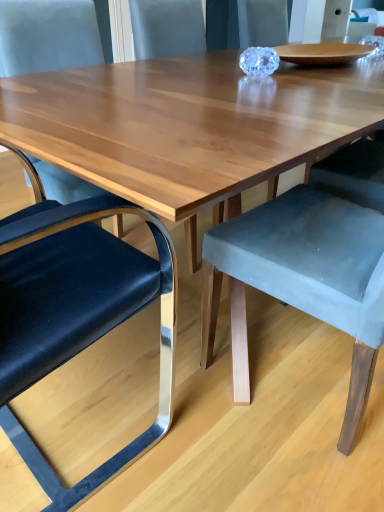
Question: Is metallic blue cushioned chair at left, the 1th chair from the left, positioned before velvet grey chair at center, which is counted as the third chair, starting from the left?

Choices:
 (A) no
 (B) yes

Answer: (B)

Question: Can you confirm if metallic blue cushioned chair at left, which ranks as the third chair in right-to-left order, is taller than velvet grey chair at center, which appears as the 1th chair when viewed from the right?

Choices:
 (A) no
 (B) yes

Answer: (A)

Question: Is the depth of metallic blue cushioned chair at left, the 1th chair from the left, greater than that of velvet grey chair at center, which is counted as the third chair, starting from the left?

Choices:
 (A) yes
 (B) no

Answer: (B)

Question: Can you confirm if metallic blue cushioned chair at left, the 1th chair from the left, is thinner than velvet grey chair at center, which is counted as the third chair, starting from the left?

Choices:
 (A) yes
 (B) no

Answer: (A)

Question: Are metallic blue cushioned chair at left, which ranks as the third chair in right-to-left order, and velvet grey chair at center, which appears as the 1th chair when viewed from the right, far apart?

Choices:
 (A) yes
 (B) no

Answer: (B)

Question: Considering the positions of metallic blue cushioned chair at left, the 1th chair from the left, and velvet blue chair at left, acting as the 2th chair starting from the right, in the image, is metallic blue cushioned chair at left, the 1th chair from the left, wider or thinner than velvet blue chair at left, acting as the 2th chair starting from the right,?

Choices:
 (A) thin
 (B) wide

Answer: (A)

Question: In the image, is metallic blue cushioned chair at left, the 1th chair from the left, positioned in front of or behind velvet blue chair at left, which is counted as the second chair, starting from the left?

Choices:
 (A) front
 (B) behind

Answer: (A)

Question: Does point (8, 429) appear closer or farther from the camera than point (71, 189)?

Choices:
 (A) closer
 (B) farther

Answer: (A)

Question: From a real-world perspective, is metallic blue cushioned chair at left, the 1th chair from the left, positioned above or below velvet blue chair at left, acting as the 2th chair starting from the right?

Choices:
 (A) above
 (B) below

Answer: (B)

Question: From a real-world perspective, is velvet blue chair at left, acting as the 2th chair starting from the right, above or below velvet grey chair at center, which is counted as the third chair, starting from the left?

Choices:
 (A) below
 (B) above

Answer: (B)

Question: Considering the relative positions of velvet blue chair at left, acting as the 2th chair starting from the right, and velvet grey chair at center, which is counted as the third chair, starting from the left, in the image provided, is velvet blue chair at left, acting as the 2th chair starting from the right, to the left or to the right of velvet grey chair at center, which is counted as the third chair, starting from the left,?

Choices:
 (A) left
 (B) right

Answer: (A)

Question: Considering the positions of velvet blue chair at left, which is counted as the second chair, starting from the left, and velvet grey chair at center, which appears as the 1th chair when viewed from the right, in the image, is velvet blue chair at left, which is counted as the second chair, starting from the left, taller or shorter than velvet grey chair at center, which appears as the 1th chair when viewed from the right,?

Choices:
 (A) short
 (B) tall

Answer: (A)

Question: Is velvet blue chair at left, acting as the 2th chair starting from the right, inside or outside of velvet grey chair at center, which appears as the 1th chair when viewed from the right?

Choices:
 (A) inside
 (B) outside

Answer: (B)

Question: In terms of size, does velvet grey chair at center, which is counted as the third chair, starting from the left, appear bigger or smaller than metallic blue cushioned chair at left, which ranks as the third chair in right-to-left order?

Choices:
 (A) small
 (B) big

Answer: (A)

Question: Is velvet grey chair at center, which appears as the 1th chair when viewed from the right, spatially inside metallic blue cushioned chair at left, the 1th chair from the left, or outside of it?

Choices:
 (A) outside
 (B) inside

Answer: (A)